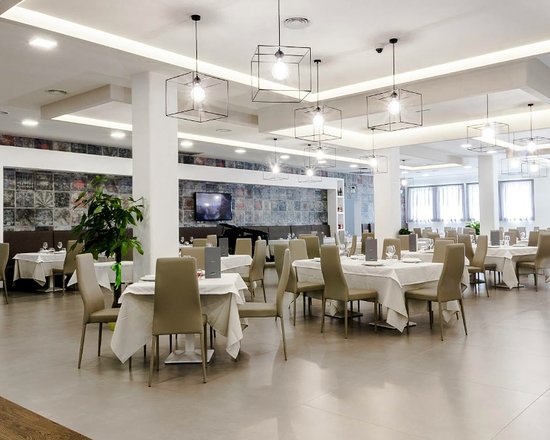
Where is `tables`? tables is located at coordinates (386, 272), (506, 251), (423, 242), (235, 263), (44, 264), (358, 247), (100, 267).